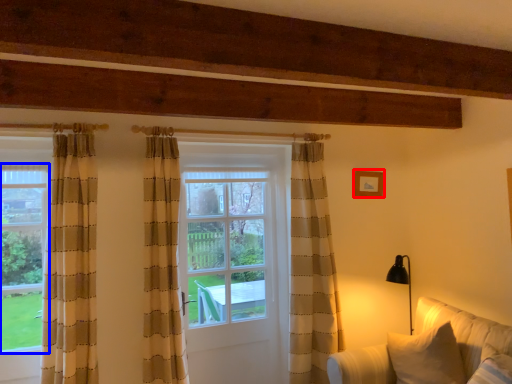
Question: Among these objects, which one is nearest to the camera, picture frame (highlighted by a red box) or bay window (highlighted by a blue box)?

Choices:
 (A) picture frame
 (B) bay window

Answer: (B)